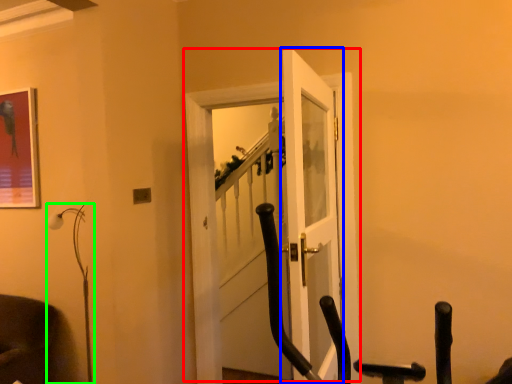
Question: Estimate the real-world distances between objects in this image. Which object is closer to door (highlighted by a red box), door (highlighted by a blue box) or lamp (highlighted by a green box)?

Choices:
 (A) door
 (B) lamp

Answer: (A)